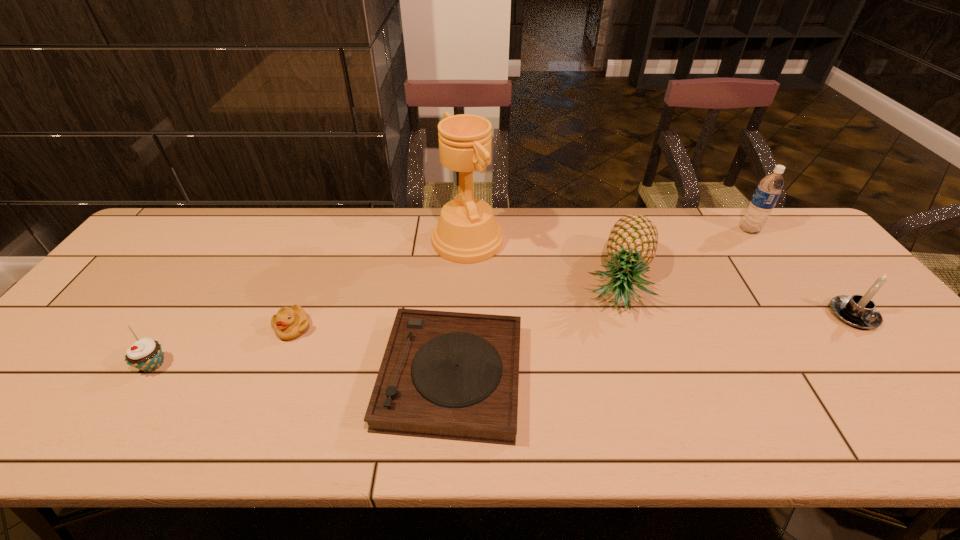
I want to click on object present at the near edge, so click(x=445, y=375).

This screenshot has height=540, width=960. In order to click on water bottle that is at the right edge in this screenshot , I will do `click(768, 191)`.

Identify the location of candle holder present at the right edge. (859, 311).

Locate an element on the screen. This screenshot has width=960, height=540. object located in the far right corner section of the desktop is located at coordinates (768, 191).

Identify the location of free spot at the far edge of the desktop. Image resolution: width=960 pixels, height=540 pixels. (385, 227).

Where is `vacant region at the near edge of the desktop`? This screenshot has height=540, width=960. vacant region at the near edge of the desktop is located at coordinates [x=815, y=433].

Image resolution: width=960 pixels, height=540 pixels. Find the location of `free location at the left edge`. free location at the left edge is located at coordinates (187, 254).

I want to click on vacant space at the right edge of the desktop, so click(924, 364).

This screenshot has height=540, width=960. In order to click on free point at the near left corner in this screenshot , I will do `click(8, 410)`.

The height and width of the screenshot is (540, 960). I want to click on vacant space in between the cupcake and the fifth object from left to right, so click(386, 323).